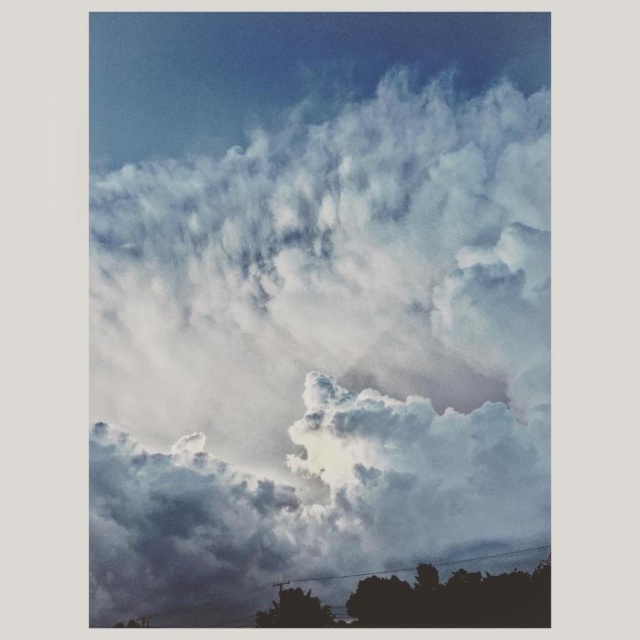
You are an airplane pilot flying through the clouds. You notice a white fluffy cloud at center and a silhouette tree at bottom below you. Which object appears bigger from your viewpoint?

The white fluffy cloud at center appears bigger than the silhouette tree at bottom because it has a larger size compared to the silhouette tree at bottom.

In the scene shown: You are a bird flying in the sky and want to land on the silhouette tree at bottom. What are the coordinates where you should aim to land?

The silhouette tree at bottom is located at coordinates point (424, 602). You should aim for point (424, 602) to land on it.

You are a bird soaring in the sky and spot a white fluffy cloud at center and a silhouette tree at bottom. Which object is higher from the ground? Please explain your reasoning based on their positions in the image.

The white fluffy cloud at center is higher from the ground than the silhouette tree at bottom because it is positioned above the silhouette tree at bottom in the image.